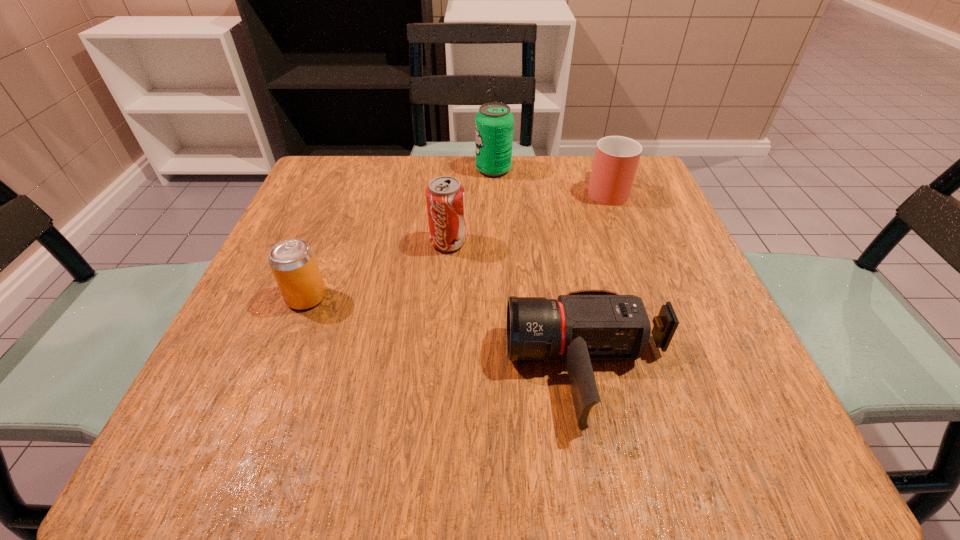
The image size is (960, 540). Find the location of `free location located on the front of the second object from left to right`. free location located on the front of the second object from left to right is located at coordinates (431, 458).

The width and height of the screenshot is (960, 540). Identify the location of free space located on the side of the cup with the handle. (594, 157).

Locate an element on the screen. The height and width of the screenshot is (540, 960). vacant area situated on the back of the leftmost object is located at coordinates (335, 223).

You are a GUI agent. You are given a task and a screenshot of the screen. Output one action in this format:
    pyautogui.click(x=<x>, y=<y>)
    Task: Click on the vacant space positioned on the lens of the nearest object
    
    Given the screenshot: What is the action you would take?
    pyautogui.click(x=475, y=369)

Locate an element on the screen. Image resolution: width=960 pixels, height=540 pixels. free point located 0.170m on the lens of the nearest object is located at coordinates (396, 369).

The width and height of the screenshot is (960, 540). I want to click on free space located 0.090m on the lens of the nearest object, so click(x=448, y=369).

What are the coordinates of `pop soda located at the far edge` in the screenshot? It's located at point(494,122).

Where is `cup located at the far edge`? cup located at the far edge is located at coordinates 616,160.

In order to click on object positioned at the near edge in this screenshot , I will do `click(584, 325)`.

Image resolution: width=960 pixels, height=540 pixels. Find the location of `object that is at the left edge`. object that is at the left edge is located at coordinates (293, 263).